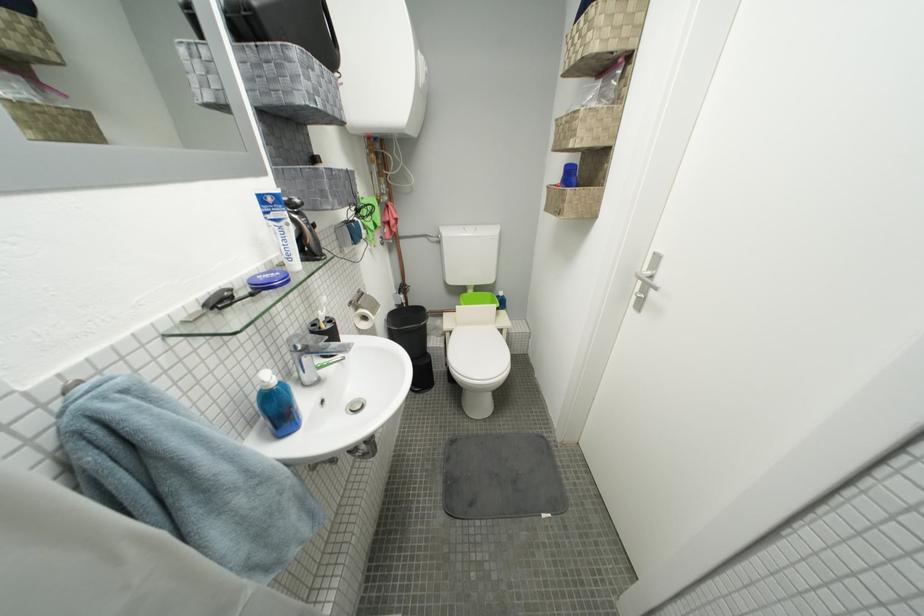
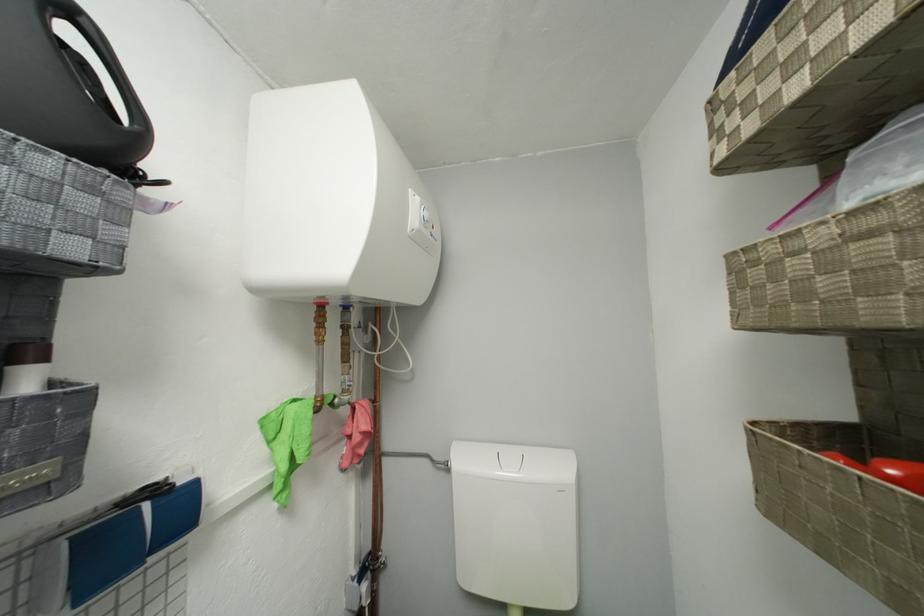
Question: I am providing you with two images of the same scene from different viewpoints. Which of the following objects are not visible in image2?

Choices:
 (A) black kettle handle
 (B) red valve handle
 (C) pink cloth
 (D) none of these

Answer: (D)